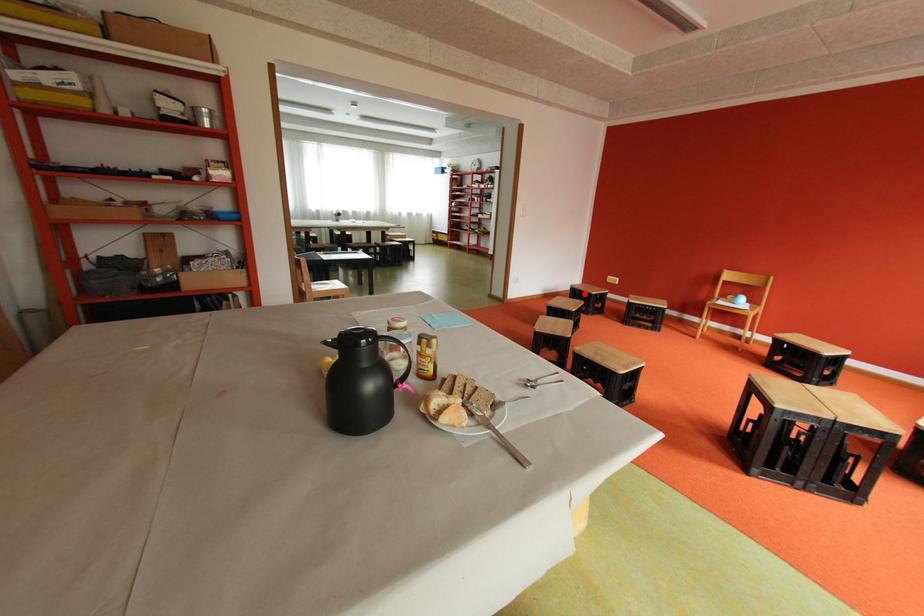
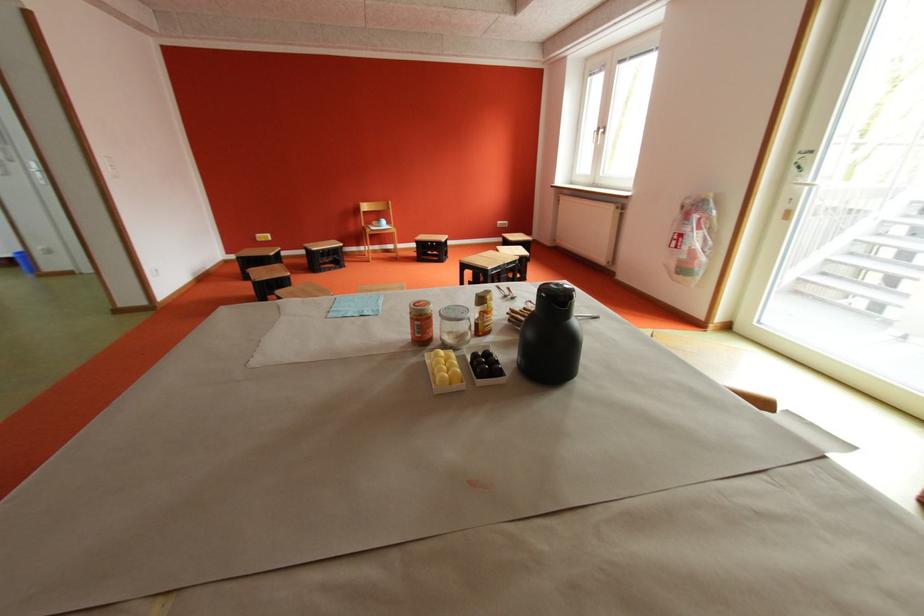
Where in the second image is the point corresponding to the highlighted location from the first image?

(257, 262)